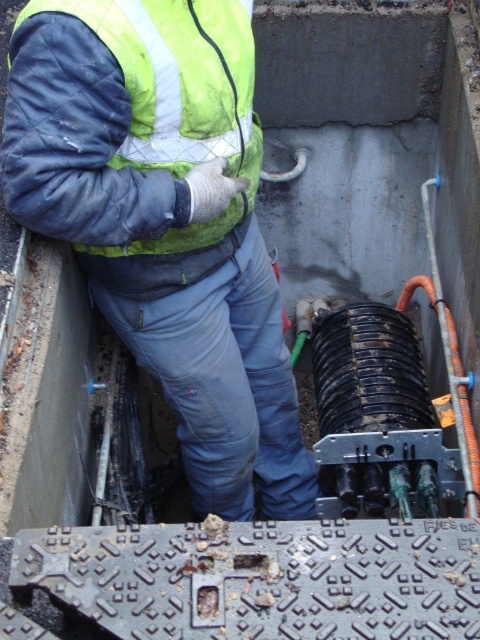
Between point (224, 131) and point (242, 4), which one is positioned in front?

Positioned in front is point (224, 131).

Who is lower down, reflective yellow-green vest at center or reflective quilted jacket at upper left?

reflective yellow-green vest at center is below.

Who is more forward, (189, 186) or (240, 118)?

Point (189, 186)

At what (x,y) coordinates should I click in order to perform the action: click on reflective yellow-green vest at center. Please return your answer as a coordinate pair (x, y). Looking at the image, I should click on (166, 220).